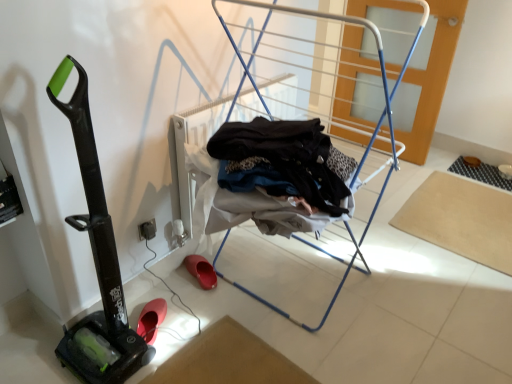
Image resolution: width=512 pixels, height=384 pixels. I want to click on vacant area that is situated to the right of rubber/soft sole shoe at lower left, the second footwear when ordered from right to left, so click(187, 318).